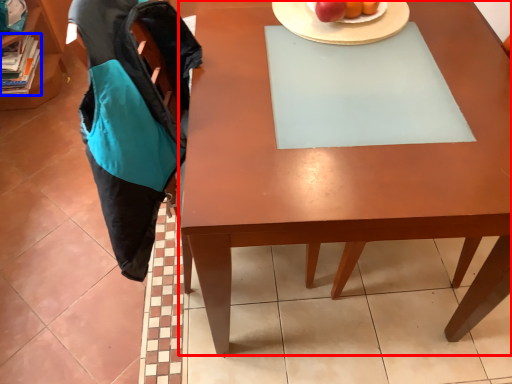
Question: Among these objects, which one is farthest to the camera, desk (highlighted by a red box) or book (highlighted by a blue box)?

Choices:
 (A) desk
 (B) book

Answer: (B)